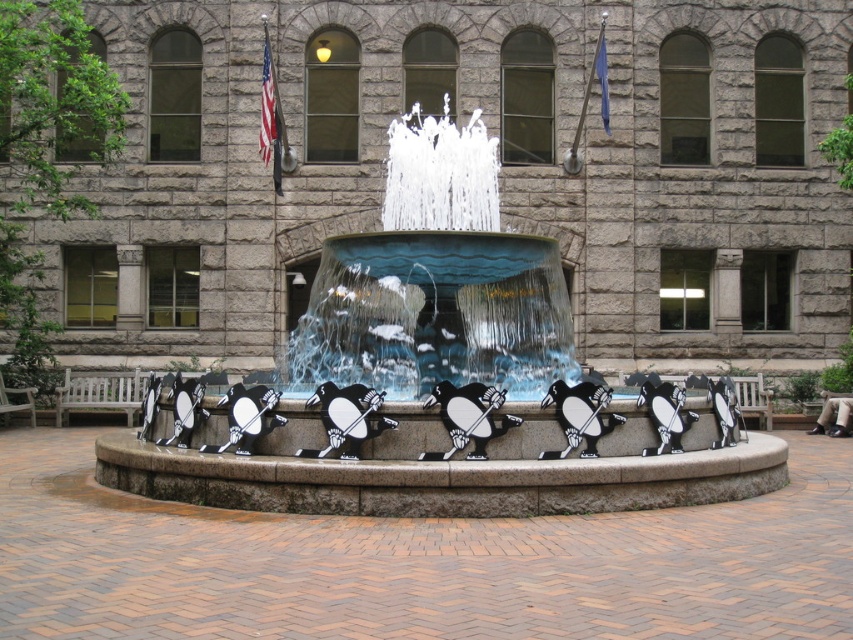
Question: Can you confirm if white glossy water at center is smaller than blue glass water at center?

Choices:
 (A) yes
 (B) no

Answer: (B)

Question: Among these points, which one is nearest to the camera?

Choices:
 (A) (438, 273)
 (B) (525, 275)

Answer: (A)

Question: Can you confirm if white glossy water at center is positioned to the left of blue glass water at center?

Choices:
 (A) no
 (B) yes

Answer: (B)

Question: Observing the image, what is the correct spatial positioning of white glossy water at center in reference to blue glass water at center?

Choices:
 (A) above
 (B) below

Answer: (B)